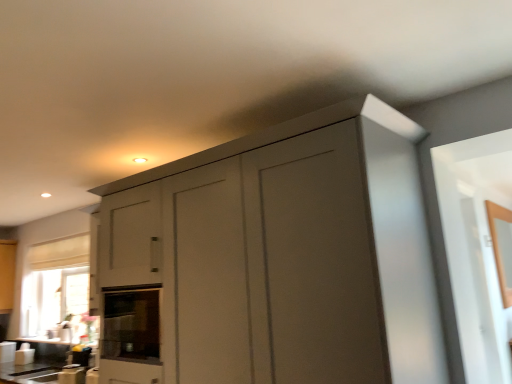
Question: Is matte gray cabinet at center not near black glass oven at center?

Choices:
 (A) yes
 (B) no

Answer: (B)

Question: From a real-world perspective, is matte gray cabinet at center physically below black glass oven at center?

Choices:
 (A) yes
 (B) no

Answer: (B)

Question: Is matte gray cabinet at center smaller than black glass oven at center?

Choices:
 (A) yes
 (B) no

Answer: (B)

Question: Does matte gray cabinet at center appear on the left side of black glass oven at center?

Choices:
 (A) no
 (B) yes

Answer: (A)

Question: Can you confirm if matte gray cabinet at center is bigger than black glass oven at center?

Choices:
 (A) no
 (B) yes

Answer: (B)

Question: From a real-world perspective, is matte gray cabinet at center positioned over black glass oven at center based on gravity?

Choices:
 (A) yes
 (B) no

Answer: (A)

Question: Can we say white glossy countertop at lower center, the 2th counter top positioned from the back, lies outside black glass oven at center?

Choices:
 (A) yes
 (B) no

Answer: (A)

Question: Can you confirm if white glossy countertop at lower center, the 2th counter top positioned from the back, is positioned to the left of black glass oven at center?

Choices:
 (A) yes
 (B) no

Answer: (A)

Question: Does white glossy countertop at lower center, which appears as the 1th counter top when viewed from the front, have a greater height compared to black glass oven at center?

Choices:
 (A) no
 (B) yes

Answer: (A)

Question: Is white glossy countertop at lower center, the 2th counter top positioned from the back, to the right of black glass oven at center from the viewer's perspective?

Choices:
 (A) yes
 (B) no

Answer: (B)

Question: Is white glossy countertop at lower center, the 2th counter top positioned from the back, far away from black glass oven at center?

Choices:
 (A) no
 (B) yes

Answer: (B)

Question: From the image's perspective, is white glossy countertop at lower center, the 2th counter top positioned from the back, on black glass oven at center?

Choices:
 (A) no
 (B) yes

Answer: (A)

Question: Is matte gray cabinet at center with white glossy countertop at lower left, positioned as the 1th counter top in back-to-front order?

Choices:
 (A) no
 (B) yes

Answer: (A)